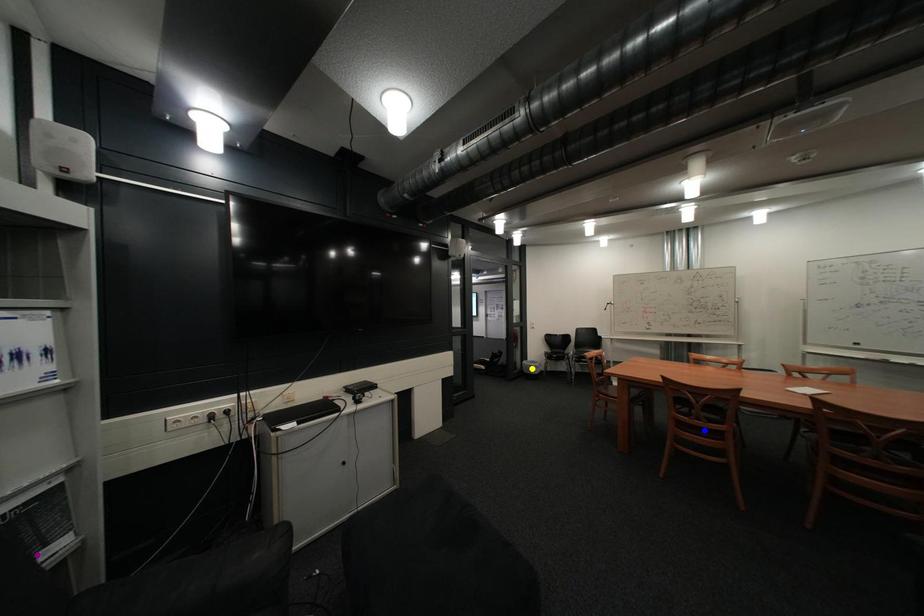
Order these from nearest to farthest:
blue point
yellow point
purple point

purple point → blue point → yellow point